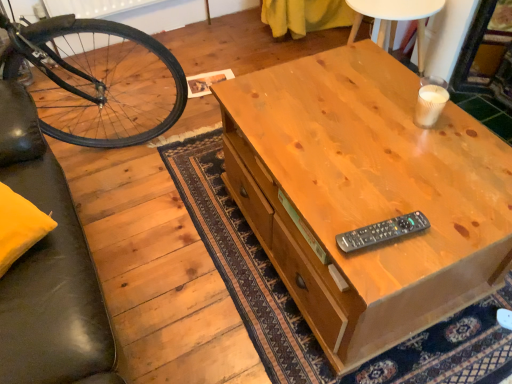
Question: Is white paper cup at upper right located outside black plastic remote at center?

Choices:
 (A) no
 (B) yes

Answer: (B)

Question: Can you see white paper cup at upper right touching black plastic remote at center?

Choices:
 (A) no
 (B) yes

Answer: (A)

Question: Considering the relative positions of white paper cup at upper right and black plastic remote at center in the image provided, is white paper cup at upper right to the left of black plastic remote at center from the viewer's perspective?

Choices:
 (A) yes
 (B) no

Answer: (B)

Question: From a real-world perspective, is white paper cup at upper right beneath black plastic remote at center?

Choices:
 (A) yes
 (B) no

Answer: (B)

Question: From the image's perspective, is white paper cup at upper right under black plastic remote at center?

Choices:
 (A) yes
 (B) no

Answer: (B)

Question: Could black plastic remote at center be considered to be inside white paper cup at upper right?

Choices:
 (A) yes
 (B) no

Answer: (B)

Question: Can you confirm if light brown wood desk at center is bigger than black plastic remote at center?

Choices:
 (A) no
 (B) yes

Answer: (B)

Question: Is black plastic remote at center inside light brown wood desk at center?

Choices:
 (A) yes
 (B) no

Answer: (B)

Question: Is light brown wood desk at center not close to black plastic remote at center?

Choices:
 (A) no
 (B) yes

Answer: (A)

Question: Is light brown wood desk at center at the right side of black plastic remote at center?

Choices:
 (A) no
 (B) yes

Answer: (B)

Question: From a real-world perspective, is light brown wood desk at center positioned under black plastic remote at center based on gravity?

Choices:
 (A) no
 (B) yes

Answer: (B)

Question: Is light brown wood desk at center to the left of black plastic remote at center from the viewer's perspective?

Choices:
 (A) yes
 (B) no

Answer: (B)

Question: Can you confirm if light brown wood desk at center is shorter than white paper cup at upper right?

Choices:
 (A) yes
 (B) no

Answer: (B)